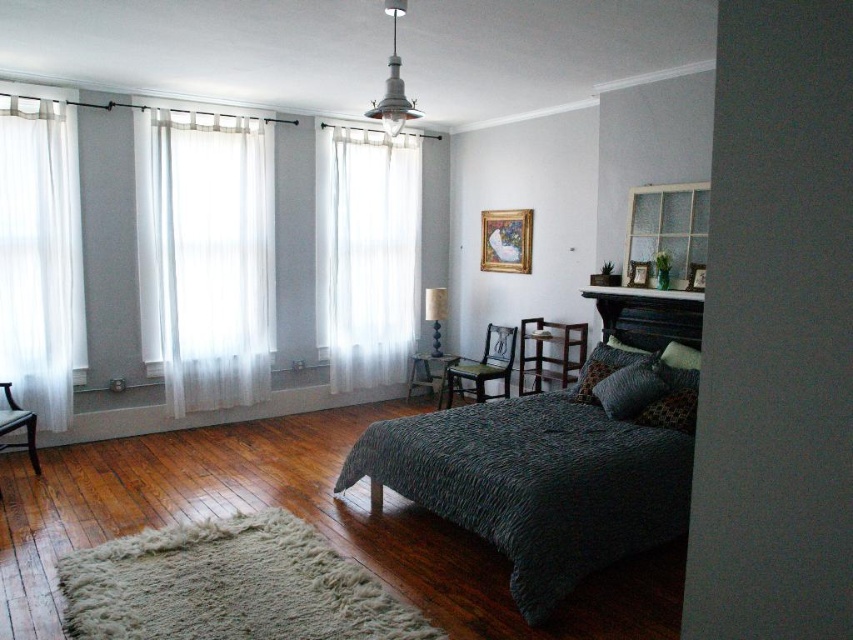
You are arranging a photo shoot in this bedroom and need to place a camera on the velvet green pillow at center. Can the camera be placed directly on the pillow without it touching the wooden stool at center?

The velvet green pillow at center is positioned over the wooden stool at center, so placing the camera on the pillow would mean it is also resting on the stool beneath it. However, the pillow itself is separate from the stool, so the camera would be on the pillow but in contact with the stool.